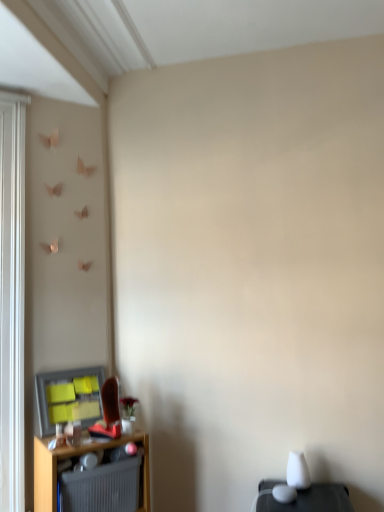
Question: Considering the positions of matte plastic window screen at lower left and gray ribbed radiator at lower left in the image, is matte plastic window screen at lower left wider or thinner than gray ribbed radiator at lower left?

Choices:
 (A) thin
 (B) wide

Answer: (A)

Question: Which is correct: matte plastic window screen at lower left is inside gray ribbed radiator at lower left, or outside of it?

Choices:
 (A) outside
 (B) inside

Answer: (A)

Question: Estimate the real-world distances between objects in this image. Which object is farther from the matte plastic window screen at lower left?

Choices:
 (A) wooden shelf at lower left
 (B) gray ribbed radiator at lower left

Answer: (B)

Question: Which object is the farthest from the wooden shelf at lower left?

Choices:
 (A) matte plastic window screen at lower left
 (B) gray ribbed radiator at lower left

Answer: (A)